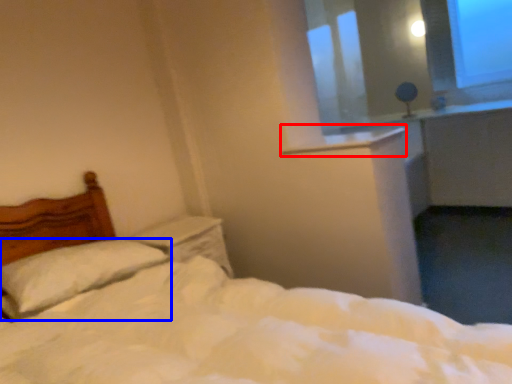
Question: Among these objects, which one is nearest to the camera, window sill (highlighted by a red box) or pillow (highlighted by a blue box)?

Choices:
 (A) window sill
 (B) pillow

Answer: (B)